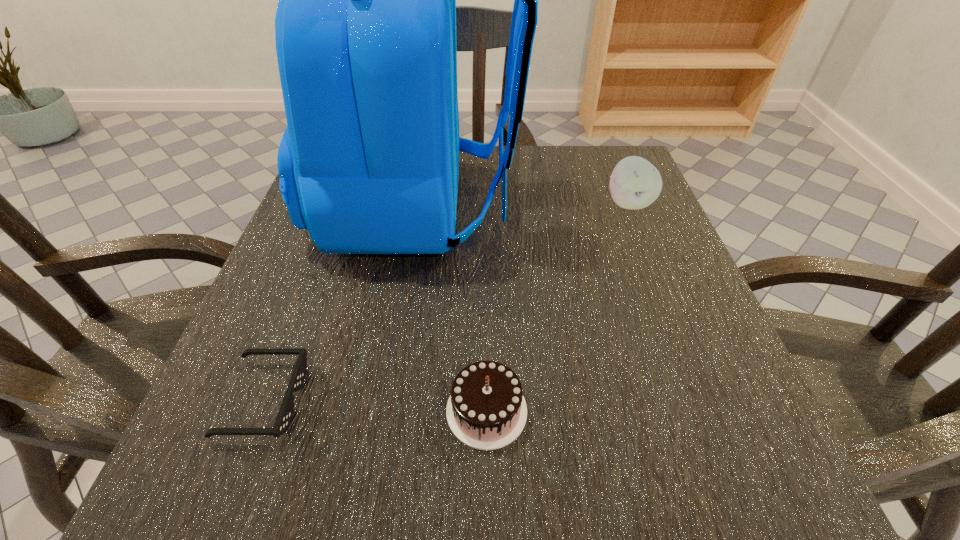
Find the location of a particular element. This screenshot has height=540, width=960. vacant region between the rightmost object and the chocolate cake is located at coordinates (558, 307).

You are a GUI agent. You are given a task and a screenshot of the screen. Output one action in this format:
    pyautogui.click(x=<x>, y=<y>)
    Task: Click on the vacant area that lies between the tallest object and the rightmost object
    
    Given the screenshot: What is the action you would take?
    pyautogui.click(x=524, y=206)

You are a GUI agent. You are given a task and a screenshot of the screen. Output one action in this format:
    pyautogui.click(x=<x>, y=<y>)
    Task: Click on the unoccupied position between the shortest object and the second shortest object
    The image size is (960, 540).
    Given the screenshot: What is the action you would take?
    pyautogui.click(x=375, y=405)

Locate an element on the screen. the second closest object to the sunglasses is located at coordinates (486, 410).

Identify which object is the closest to the shortest object. Please provide its 2D coordinates. Your answer should be formatted as a tuple, i.e. [(x, y)], where the tuple contains the x and y coordinates of a point satisfying the conditions above.

[(365, 28)]

Identify the location of free location that satisfies the following two spatial constraints: 1. on the back of the third tallest object; 2. on the left side of the tallest object. (387, 411).

This screenshot has width=960, height=540. I want to click on free spot that satisfies the following two spatial constraints: 1. on the back of the backpack; 2. on the back side of the chocolate cake, so click(387, 411).

Find the location of a particular element. The width and height of the screenshot is (960, 540). free region that satisfies the following two spatial constraints: 1. on the back side of the chocolate cake; 2. on the front-facing side of the sunglasses is located at coordinates (487, 399).

What are the coordinates of `vacant region that satisfies the following two spatial constraints: 1. on the back side of the rightmost object; 2. on the left side of the chocolate cake` in the screenshot? It's located at (484, 203).